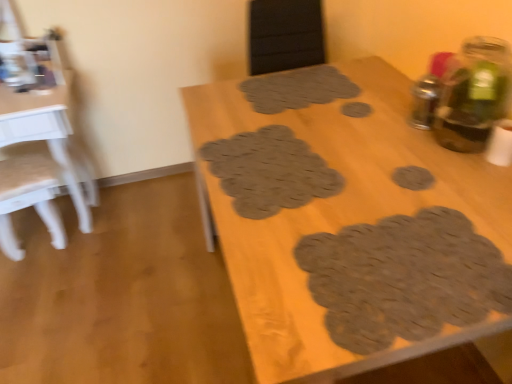
Find the location of a particular element. free space to the right of brown felt coaster at center, acting as the 2th footprint starting from the top is located at coordinates (393, 114).